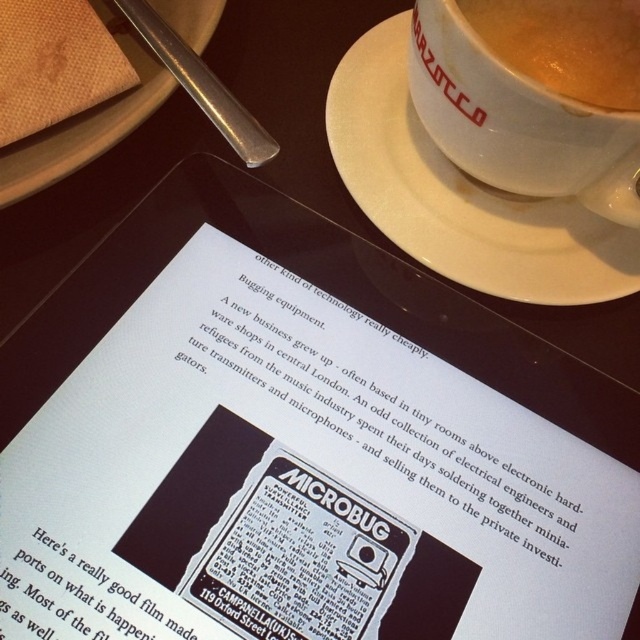
Which is in front, point (129, 328) or point (564, 252)?

Point (129, 328) is more forward.

Locate an element on the screen. This screenshot has height=640, width=640. white paper at center is located at coordinates (304, 480).

This screenshot has width=640, height=640. Identify the location of white paper at center. (304, 480).

Does white paper at center come behind brown textured plate at upper left?

No.

Does point (356, 312) come behind point (40, 179)?

Yes.

This screenshot has width=640, height=640. What are the coordinates of `white paper at center` in the screenshot? It's located at (304, 480).

Can you confirm if white paper at center is smaller than matte white cup at upper right?

No.

This screenshot has height=640, width=640. What are the coordinates of `white paper at center` in the screenshot? It's located at (304, 480).

Identify the location of white paper at center. (304, 480).